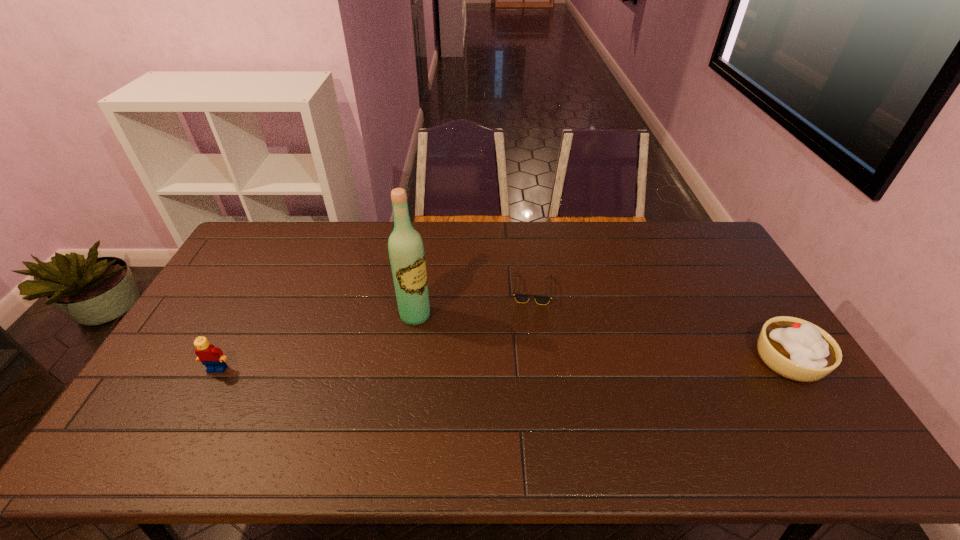
The height and width of the screenshot is (540, 960). I want to click on Lego, so click(212, 357).

Where is `whipped cream`? The height and width of the screenshot is (540, 960). whipped cream is located at coordinates (796, 349).

Identify the location of the second object from right to left. (520, 298).

I want to click on the shortest object, so click(x=520, y=298).

Find the location of a particular element. Image resolution: width=960 pixels, height=540 pixels. the tallest object is located at coordinates [x=406, y=252].

Identify the location of the second object from left to right. The image size is (960, 540). [406, 252].

Find the location of a particular element. vacant space located on the front-facing side of the leftmost object is located at coordinates click(196, 409).

Find the location of a particular element. The width and height of the screenshot is (960, 540). free space located 0.200m on the left of the whipped cream is located at coordinates (684, 360).

At what (x,y) coordinates should I click in order to perform the action: click on vacant area situated on the lenses of the shortest object. Please return your answer as a coordinate pair (x, y). The image size is (960, 540). Looking at the image, I should click on tap(583, 368).

You are a GUI agent. You are given a task and a screenshot of the screen. Output one action in this format:
    pyautogui.click(x=<x>, y=<y>)
    Task: Click on the free space located on the lenses of the shortest object
    The image size is (960, 540).
    Given the screenshot: What is the action you would take?
    pyautogui.click(x=575, y=357)